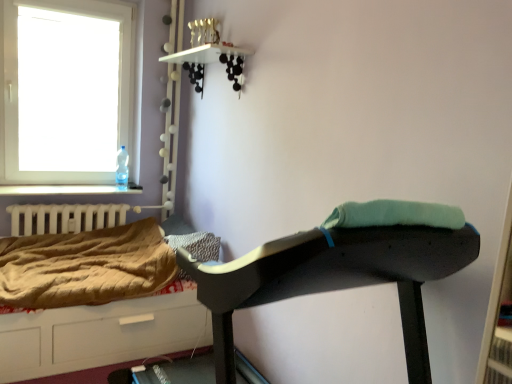
The height and width of the screenshot is (384, 512). What are the coordinates of `transparent plastic bottle at window left` in the screenshot? It's located at (122, 168).

In order to face brown quilted hospital bed at lower left, should I rotate leftwards or rightwards?

Turn left by 18.703 degrees to look at brown quilted hospital bed at lower left.

Find the location of a particular element. This screenshot has height=384, width=512. brown quilted blanket at lower left is located at coordinates (85, 266).

The height and width of the screenshot is (384, 512). Describe the element at coordinates (85, 266) in the screenshot. I see `brown quilted blanket at lower left` at that location.

This screenshot has width=512, height=384. Find the location of `matte black ironing board at center`. matte black ironing board at center is located at coordinates (335, 278).

Where is `transparent plastic bottle at window left`? transparent plastic bottle at window left is located at coordinates (122, 168).

How many degrees apart are the facing directions of brown quilted hospital bed at lower left and white matte radiator at left?

The angle between the facing direction of brown quilted hospital bed at lower left and the facing direction of white matte radiator at left is 1.18 degrees.

Is brown quilted hospital bed at lower left oriented away from white matte radiator at left?

Yes, brown quilted hospital bed at lower left is facing away from white matte radiator at left.

Who is shorter, brown quilted hospital bed at lower left or white matte radiator at left?

white matte radiator at left is shorter.

Looking at the image, does brown quilted hospital bed at lower left seem bigger or smaller compared to white matte radiator at left?

Considering their sizes, brown quilted hospital bed at lower left takes up more space than white matte radiator at left.

Does brown quilted hospital bed at lower left turn towards transparent glass window at upper left?

No, brown quilted hospital bed at lower left is not aimed at transparent glass window at upper left.

Is transparent glass window at upper left a part of brown quilted hospital bed at lower left?

That's incorrect, transparent glass window at upper left is not inside brown quilted hospital bed at lower left.

Is brown quilted hospital bed at lower left far from transparent glass window at upper left?

Yes, brown quilted hospital bed at lower left is far from transparent glass window at upper left.

From a real-world perspective, is brown quilted hospital bed at lower left physically located above or below transparent glass window at upper left?

In terms of real-world spatial position, brown quilted hospital bed at lower left is below transparent glass window at upper left.

Consider the image. Does white matte radiator at left contain transparent plastic bottle at window left?

No, transparent plastic bottle at window left is located outside of white matte radiator at left.

Is white matte radiator at left at the right side of transparent plastic bottle at window left?

Incorrect, white matte radiator at left is not on the right side of transparent plastic bottle at window left.

Between point (117, 215) and point (121, 177), which one is positioned in front?

Positioned in front is point (117, 215).

Which of these two, white matte radiator at left or transparent plastic bottle at window left, is smaller?

With smaller size is transparent plastic bottle at window left.

From a real-world perspective, is transparent plastic bottle at window left over white matte radiator at left?

Yes, from a real-world perspective, transparent plastic bottle at window left is over white matte radiator at left

Does transparent plastic bottle at window left come in front of white matte radiator at left?

No, transparent plastic bottle at window left is further to the viewer.

Considering the sizes of transparent plastic bottle at window left and white matte radiator at left in the image, is transparent plastic bottle at window left bigger or smaller than white matte radiator at left?

In the image, transparent plastic bottle at window left appears to be smaller than white matte radiator at left.

From the image's perspective, which object appears higher, transparent plastic bottle at window left or white matte radiator at left?

transparent plastic bottle at window left.

Considering their positions, is matte black ironing board at center located in front of or behind transparent plastic bottle at window left?

matte black ironing board at center is in front of transparent plastic bottle at window left.

Considering the sizes of objects matte black ironing board at center and transparent plastic bottle at window left in the image provided, who is bigger, matte black ironing board at center or transparent plastic bottle at window left?

matte black ironing board at center.

Would you say matte black ironing board at center is inside or outside transparent plastic bottle at window left?

matte black ironing board at center lies outside transparent plastic bottle at window left.

The image size is (512, 384). In the image, there is a transparent plastic bottle at window left. Identify the location of furniture below it (from a real-world perspective). (335, 278).

From the image's perspective, is transparent plastic bottle at window left on brown quilted hospital bed at lower left?

Yes.

Is transparent plastic bottle at window left positioned with its back to brown quilted hospital bed at lower left?

No, transparent plastic bottle at window left's orientation is not away from brown quilted hospital bed at lower left.

In the scene shown: Considering the sizes of objects transparent plastic bottle at window left and brown quilted hospital bed at lower left in the image provided, who is taller, transparent plastic bottle at window left or brown quilted hospital bed at lower left?

With more height is brown quilted hospital bed at lower left.

Is transparent plastic bottle at window left in contact with brown quilted hospital bed at lower left?

No.

Between brown quilted blanket at lower left and white matte radiator at left, which one appears on the left side from the viewer's perspective?

Positioned to the left is white matte radiator at left.

Where is `radiator on the left side of brown quilted blanket at lower left`? This screenshot has height=384, width=512. radiator on the left side of brown quilted blanket at lower left is located at coordinates (65, 217).

Would you consider brown quilted blanket at lower left to be distant from white matte radiator at left?

They are positioned close to each other.

Which is farther from the camera, (99,241) or (40,230)?

The point (99,241) is farther from the camera.

Where is `hospital bed that is in front of the white matte radiator at left`? The width and height of the screenshot is (512, 384). hospital bed that is in front of the white matte radiator at left is located at coordinates (99, 335).

Where is `window that appears above the brown quilted hospital bed at lower left (from a real-world perspective)`? This screenshot has width=512, height=384. window that appears above the brown quilted hospital bed at lower left (from a real-world perspective) is located at coordinates click(25, 86).

Considering their positions, is transparent glass window at upper left positioned further to white matte radiator at left than transparent plastic bottle at window left?

Based on the image, transparent glass window at upper left appears to be further to white matte radiator at left.

Based on their spatial positions, is brown quilted hospital bed at lower left or matte black ironing board at center further from transparent glass window at upper left?

matte black ironing board at center lies further to transparent glass window at upper left than the other object.

Estimate the real-world distances between objects in this image. Which object is further from transparent plastic bottle at window left, matte black ironing board at center or white matte radiator at left?

The object further to transparent plastic bottle at window left is matte black ironing board at center.

Looking at the image, which one is located further to white matte radiator at left, transparent plastic bottle at window left or transparent glass window at upper left?

transparent glass window at upper left is further to white matte radiator at left.

When comparing their distances from matte black ironing board at center, does transparent plastic bottle at window left or transparent glass window at upper left seem further?

Among the two, transparent glass window at upper left is located further to matte black ironing board at center.

From the image, which object appears to be farther from brown quilted hospital bed at lower left, transparent glass window at upper left or transparent plastic bottle at window left?

Among the two, transparent glass window at upper left is located further to brown quilted hospital bed at lower left.

Which object lies further to the anchor point transparent plastic bottle at window left, transparent glass window at upper left or brown quilted hospital bed at lower left?

Among the two, brown quilted hospital bed at lower left is located further to transparent plastic bottle at window left.

Considering their positions, is transparent glass window at upper left positioned further to brown quilted blanket at lower left than matte black ironing board at center?

The object further to brown quilted blanket at lower left is matte black ironing board at center.

Identify the location of hospital bed between matte black ironing board at center and transparent glass window at upper left along the z-axis. (99, 335).

Identify the location of window located between matte black ironing board at center and white matte radiator at left in the depth direction. The height and width of the screenshot is (384, 512). (25, 86).

What are the coordinates of `window between brown quilted blanket at lower left and transparent plastic bottle at window left in the front-back direction` in the screenshot? It's located at (25, 86).

Locate an element on the screen. The image size is (512, 384). radiator between transparent glass window at upper left and brown quilted blanket at lower left from top to bottom is located at coordinates (65, 217).